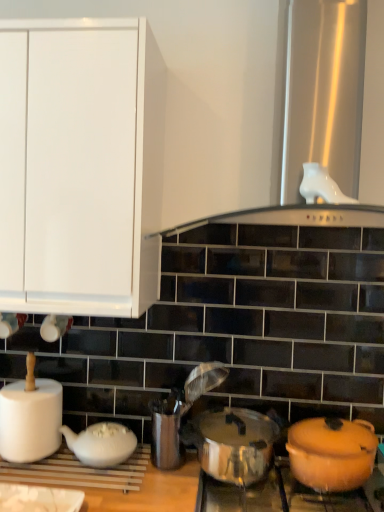
Question: From a real-world perspective, is metallic silver crock pot at center on white matte paper towel at left?

Choices:
 (A) yes
 (B) no

Answer: (B)

Question: Can white matte paper towel at left be found inside metallic silver crock pot at center?

Choices:
 (A) yes
 (B) no

Answer: (B)

Question: Does metallic silver crock pot at center have a lesser width compared to white matte paper towel at left?

Choices:
 (A) no
 (B) yes

Answer: (A)

Question: Is metallic silver crock pot at center far from white matte paper towel at left?

Choices:
 (A) no
 (B) yes

Answer: (A)

Question: Is metallic silver crock pot at center taller than white matte paper towel at left?

Choices:
 (A) yes
 (B) no

Answer: (B)

Question: Choose the correct answer: Is metallic silver crock pot at center inside orange matte pot at lower right or outside it?

Choices:
 (A) outside
 (B) inside

Answer: (A)

Question: Is metallic silver crock pot at center bigger or smaller than orange matte pot at lower right?

Choices:
 (A) small
 (B) big

Answer: (A)

Question: From a real-world perspective, is metallic silver crock pot at center above or below orange matte pot at lower right?

Choices:
 (A) below
 (B) above

Answer: (A)

Question: Is point (256, 480) positioned closer to the camera than point (331, 445)?

Choices:
 (A) farther
 (B) closer

Answer: (A)

Question: Relative to metallic silver utensil holder at center, is shiny metallic pot at lower right in front or behind?

Choices:
 (A) front
 (B) behind

Answer: (A)

Question: From their relative heights in the image, would you say shiny metallic pot at lower right is taller or shorter than metallic silver utensil holder at center?

Choices:
 (A) tall
 (B) short

Answer: (B)

Question: Based on their positions, is shiny metallic pot at lower right located to the left or right of metallic silver utensil holder at center?

Choices:
 (A) left
 (B) right

Answer: (B)

Question: Is point (322, 501) positioned closer to the camera than point (158, 399)?

Choices:
 (A) farther
 (B) closer

Answer: (B)

Question: Is white matte teapot at lower left wider or thinner than orange matte pot at lower right?

Choices:
 (A) wide
 (B) thin

Answer: (B)

Question: Considering the positions of white matte teapot at lower left and orange matte pot at lower right in the image, is white matte teapot at lower left bigger or smaller than orange matte pot at lower right?

Choices:
 (A) small
 (B) big

Answer: (A)